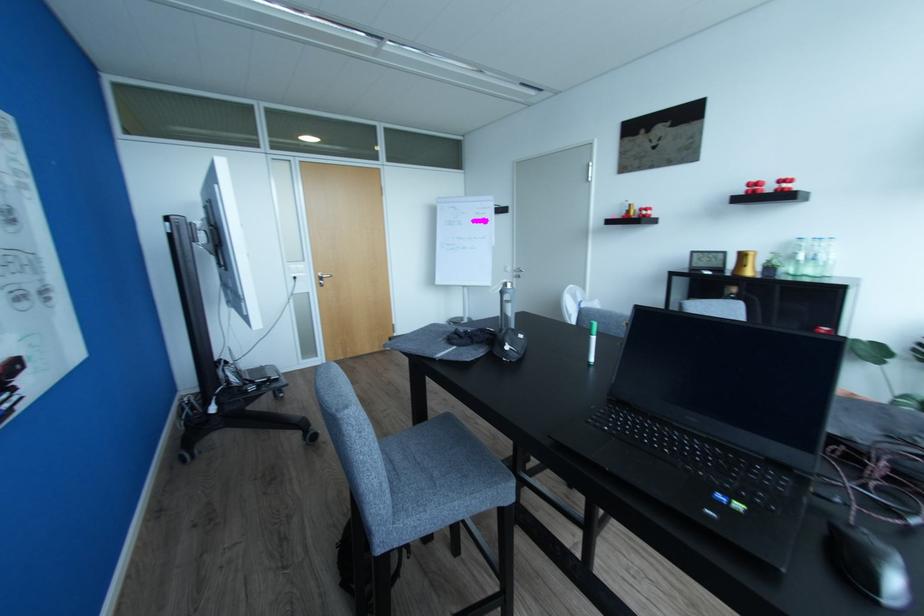
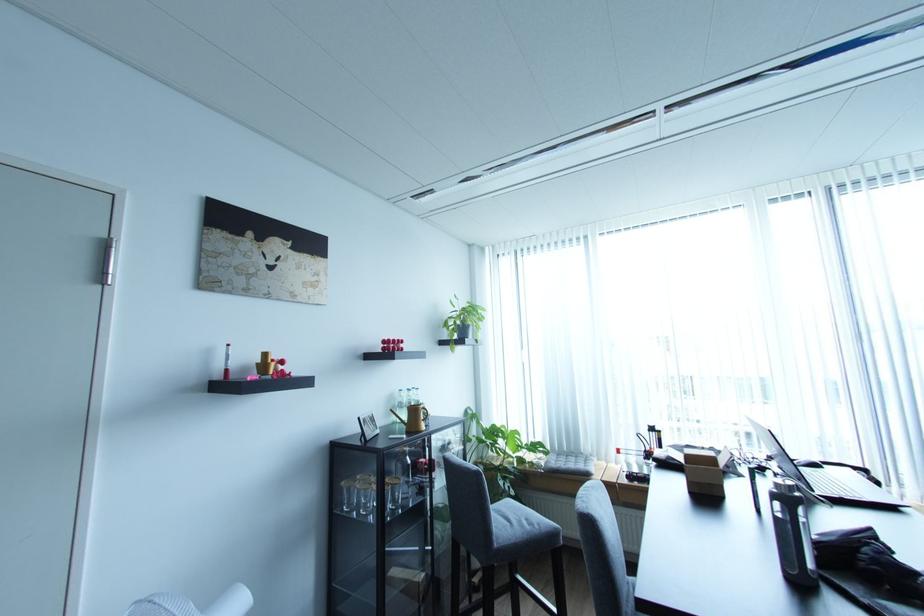
Locate, in the second image, the point that corresponds to the point at 760,180 in the first image.

(395, 339)